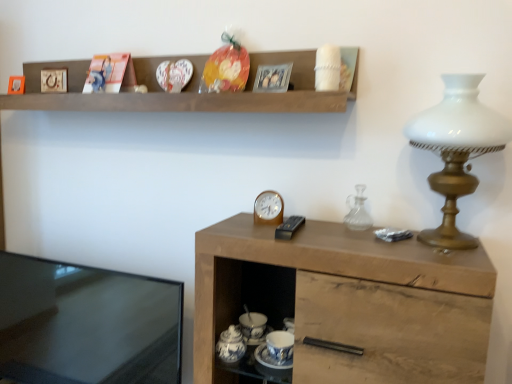
Find the location of a particular element. The height and width of the screenshot is (384, 512). free space in front of metallic silver clock at center is located at coordinates (280, 242).